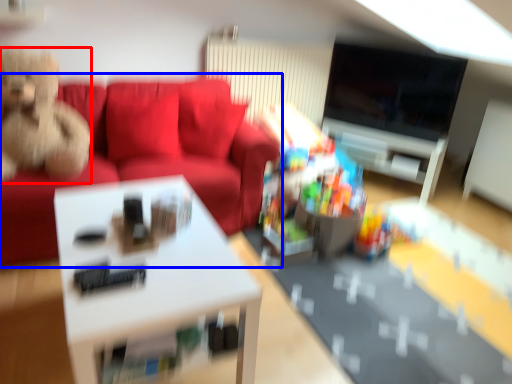
Question: Which of the following is the farthest to the observer, toy (highlighted by a red box) or studio couch (highlighted by a blue box)?

Choices:
 (A) toy
 (B) studio couch

Answer: (B)